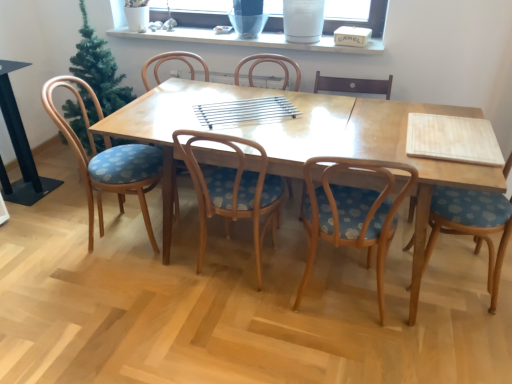
This screenshot has width=512, height=384. I want to click on free space between blue fabric chair at right, the 6th chair in the left-to-right sequence, and light brown wooden table at center, so click(x=474, y=289).